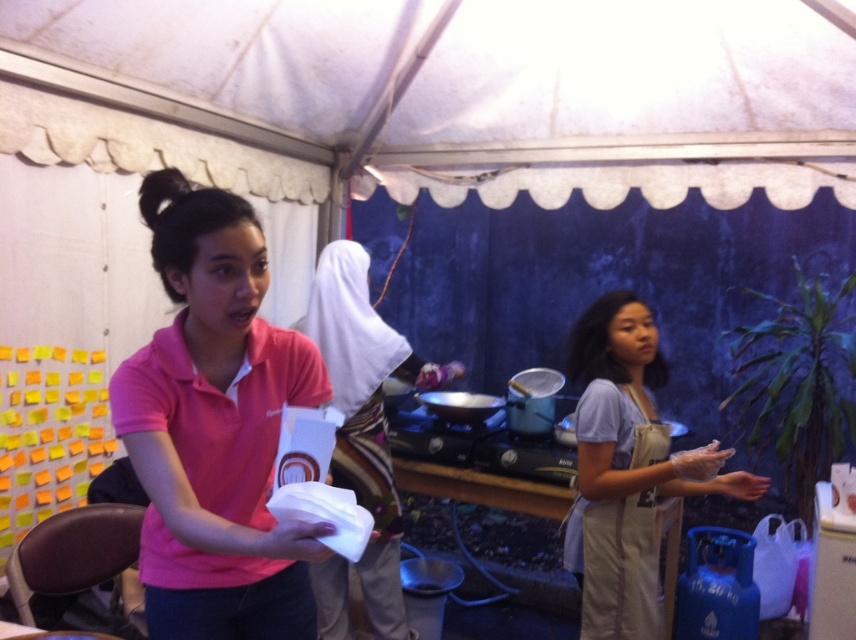
You are standing in the tented area and want to move from point [597,493] to point [319,292]. Which direction should you move to get closer to the second point?

To move from point [597,493] to point [319,292], you should move downward and to the left because point [319,292] is located lower and to the left relative to point [597,493].

You are standing in the tented area and see the point at coordinates (x=215, y=428). Which object is this point located on?

The point at coordinates (x=215, y=428) is located on the pink fabric shirt at center.

You are taking a photo of the two points in the scene. Which point, point (x=183, y=524) or point (x=385, y=563), will appear larger in your photo?

A: Point (x=183, y=524) is closer to the camera than point (x=385, y=563), so it will appear larger in the photo.